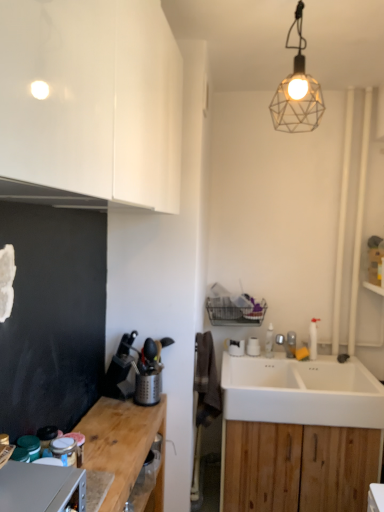
Question: Does wooden at left have a greater width compared to white wood cabinet at lower right, positioned as the 1th cabinetry in back-to-front order?

Choices:
 (A) no
 (B) yes

Answer: (A)

Question: From a real-world perspective, is wooden at left under white wood cabinet at lower right, which appears as the 1th cabinetry when viewed from the right?

Choices:
 (A) no
 (B) yes

Answer: (A)

Question: Is wooden at left oriented away from white wood cabinet at lower right, which is counted as the 1th cabinetry, starting from the bottom?

Choices:
 (A) yes
 (B) no

Answer: (B)

Question: From the image's perspective, is wooden at left over white wood cabinet at lower right, which appears as the 1th cabinetry when viewed from the right?

Choices:
 (A) no
 (B) yes

Answer: (B)

Question: Can you confirm if wooden at left is positioned to the right of white wood cabinet at lower right, acting as the 2th cabinetry starting from the left?

Choices:
 (A) yes
 (B) no

Answer: (B)

Question: Is wooden at left completely or partially outside of white wood cabinet at lower right, which appears as the 1th cabinetry when viewed from the right?

Choices:
 (A) yes
 (B) no

Answer: (A)

Question: Could matte glass jar at lower left, which ranks as the 2th appliance in back-to-front order, be considered to be inside wooden at left?

Choices:
 (A) no
 (B) yes

Answer: (A)

Question: Is the position of wooden at left less distant than that of matte glass jar at lower left, positioned as the 2th appliance in front-to-back order?

Choices:
 (A) yes
 (B) no

Answer: (A)

Question: Considering the relative sizes of wooden at left and matte glass jar at lower left, positioned as the 2th appliance in front-to-back order, in the image provided, is wooden at left shorter than matte glass jar at lower left, positioned as the 2th appliance in front-to-back order,?

Choices:
 (A) yes
 (B) no

Answer: (B)

Question: Can you confirm if wooden at left is taller than matte glass jar at lower left, which ranks as the 2th appliance in back-to-front order?

Choices:
 (A) yes
 (B) no

Answer: (A)

Question: Is wooden at left thinner than matte glass jar at lower left, positioned as the 2th appliance in front-to-back order?

Choices:
 (A) yes
 (B) no

Answer: (B)

Question: Is matte glass jar at lower left, positioned as the 2th appliance in front-to-back order, at the back of wooden at left?

Choices:
 (A) yes
 (B) no

Answer: (B)

Question: From the image's perspective, is glossy white cabinet at upper left, which is counted as the second cabinetry, starting from the back, located beneath metallic grater at left, the first appliance from the back?

Choices:
 (A) yes
 (B) no

Answer: (B)